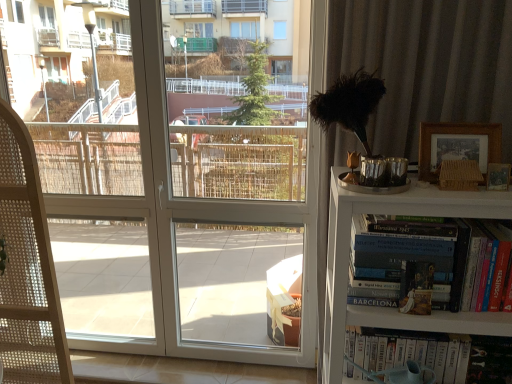
In order to click on free region on the left part of wooden picture frame at upper right, which appears as the second picture frame when viewed from the top in this screenshot , I will do click(464, 193).